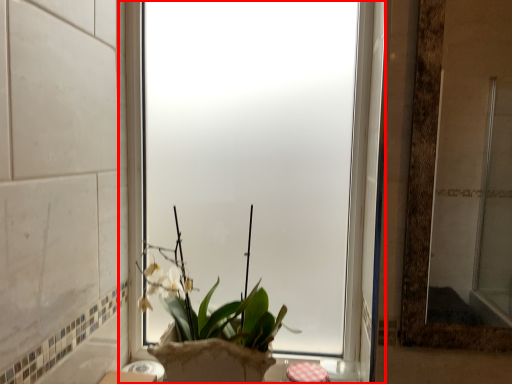
Question: From the image, what is the correct spatial relationship of window (annotated by the red box) in relation to houseplant?

Choices:
 (A) right
 (B) left

Answer: (A)